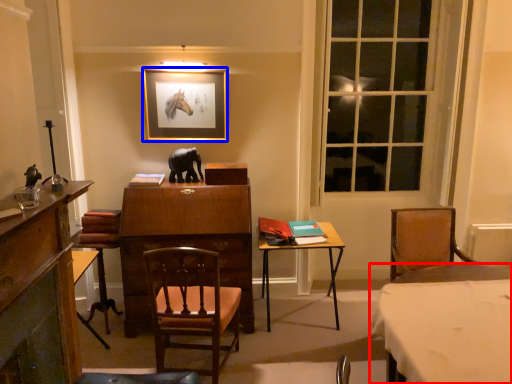
Question: Which of the following is the farthest to the observer, table (highlighted by a red box) or picture frame (highlighted by a blue box)?

Choices:
 (A) table
 (B) picture frame

Answer: (B)